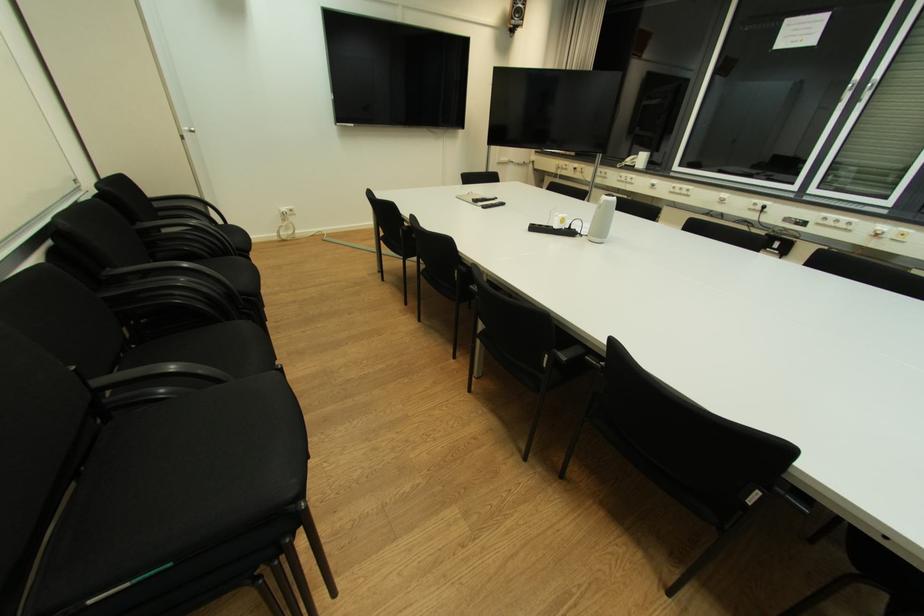
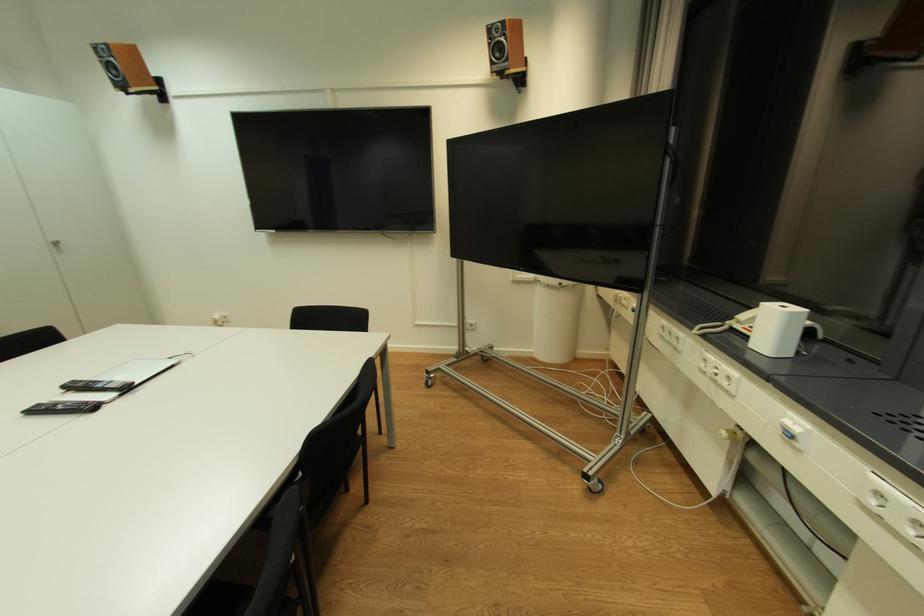
Locate, in the second image, the point that corresponds to point (516, 168) in the first image.

(544, 290)